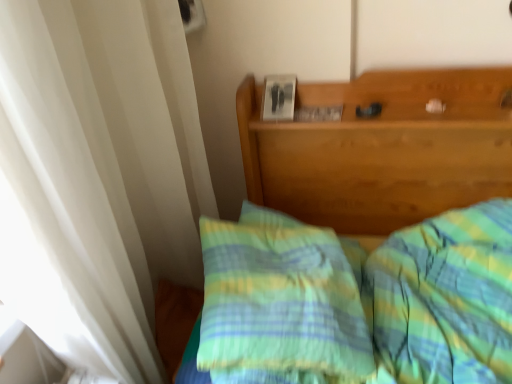
Question: Should I look upward or downward to see green striped pillow at center?

Choices:
 (A) up
 (B) down

Answer: (B)

Question: Is the position of green plaid bedspread at center less distant than that of green striped pillow at center?

Choices:
 (A) yes
 (B) no

Answer: (A)

Question: Considering the relative sizes of green plaid bedspread at center and green striped pillow at center in the image provided, is green plaid bedspread at center taller than green striped pillow at center?

Choices:
 (A) yes
 (B) no

Answer: (A)

Question: From a real-world perspective, is green plaid bedspread at center under green striped pillow at center?

Choices:
 (A) yes
 (B) no

Answer: (A)

Question: Is green plaid bedspread at center positioned beyond the bounds of green striped pillow at center?

Choices:
 (A) no
 (B) yes

Answer: (B)

Question: Is green plaid bedspread at center oriented away from green striped pillow at center?

Choices:
 (A) yes
 (B) no

Answer: (B)

Question: Can you confirm if green plaid bedspread at center is positioned to the left of green striped pillow at center?

Choices:
 (A) no
 (B) yes

Answer: (A)

Question: From a real-world perspective, is green striped pillow at center on top of green plaid bedspread at center?

Choices:
 (A) no
 (B) yes

Answer: (B)

Question: Is green striped pillow at center shorter than green plaid bedspread at center?

Choices:
 (A) yes
 (B) no

Answer: (A)

Question: Is green plaid bedspread at center located within green striped pillow at center?

Choices:
 (A) yes
 (B) no

Answer: (B)

Question: Is green striped pillow at center positioned before green plaid bedspread at center?

Choices:
 (A) no
 (B) yes

Answer: (A)

Question: Is green striped pillow at center to the right of green plaid bedspread at center from the viewer's perspective?

Choices:
 (A) no
 (B) yes

Answer: (A)

Question: Is green striped pillow at center wider than green plaid bedspread at center?

Choices:
 (A) yes
 (B) no

Answer: (B)

Question: Considering the positions of green striped pillow at center and green plaid bedspread at center in the image, is green striped pillow at center taller or shorter than green plaid bedspread at center?

Choices:
 (A) tall
 (B) short

Answer: (B)